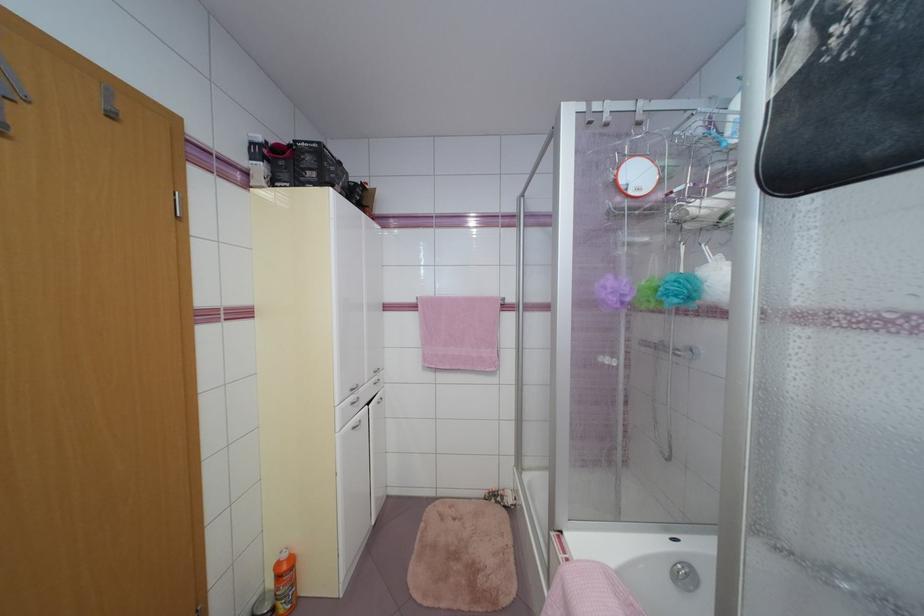
Where would you squeez the white loofah? Please return your answer as a coordinate pair (x, y).

(779, 318)